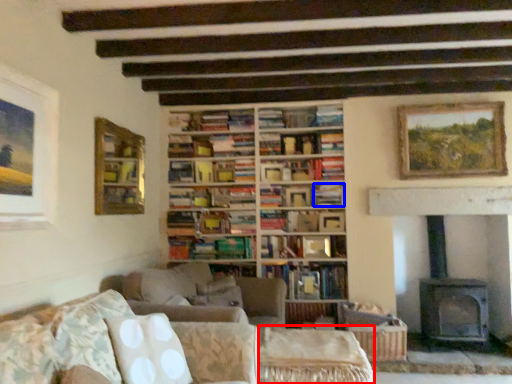
Question: Among these objects, which one is nearest to the camera, side table (highlighted by a red box) or book (highlighted by a blue box)?

Choices:
 (A) side table
 (B) book

Answer: (A)